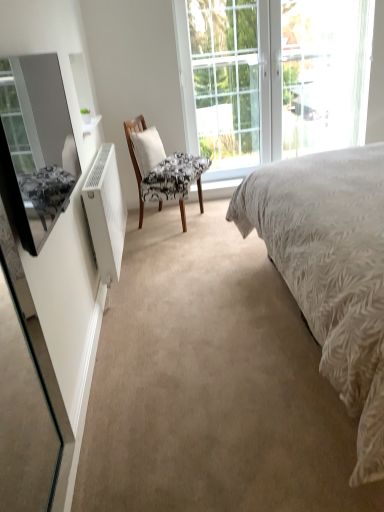
Locate an element on the screen. The width and height of the screenshot is (384, 512). free point in front of patterned fabric chair at center is located at coordinates (161, 239).